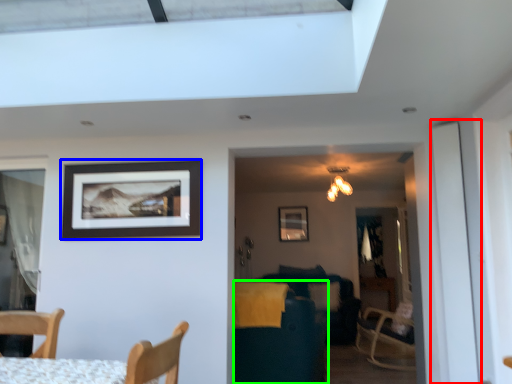
Question: Estimate the real-world distances between objects in this image. Which object is farther from screen door (highlighted by a red box), picture frame (highlighted by a blue box) or swivel chair (highlighted by a green box)?

Choices:
 (A) picture frame
 (B) swivel chair

Answer: (A)